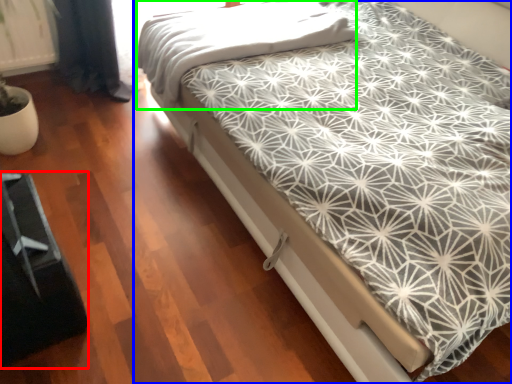
Question: Estimate the real-world distances between objects in this image. Which object is farther from bed frame (highlighted by a red box), bed (highlighted by a blue box) or blanket (highlighted by a green box)?

Choices:
 (A) bed
 (B) blanket

Answer: (B)